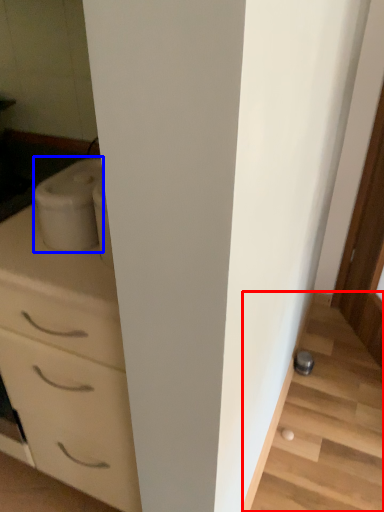
Question: Which of the following is the closest to the observer, stairwell (highlighted by a red box) or appliance (highlighted by a blue box)?

Choices:
 (A) stairwell
 (B) appliance

Answer: (B)